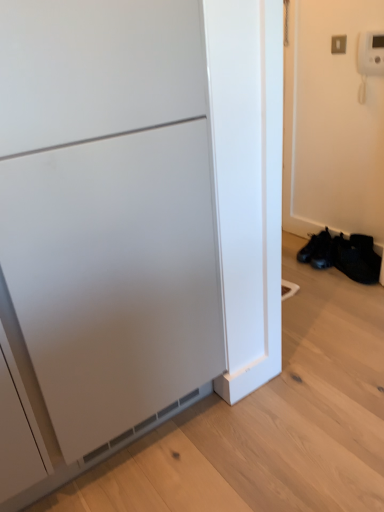
Locate an element on the screen. free space above black leather shoes at lower right (from a real-world perspective) is located at coordinates (331, 236).